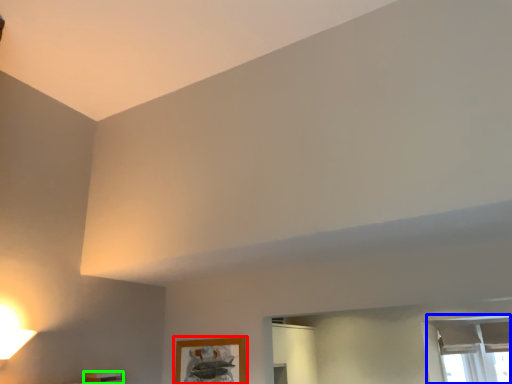
Question: Based on their relative distances, which object is farther from picture frame (highlighted by a red box)? Choose from window (highlighted by a blue box) and furniture (highlighted by a green box).

Choices:
 (A) window
 (B) furniture

Answer: (A)